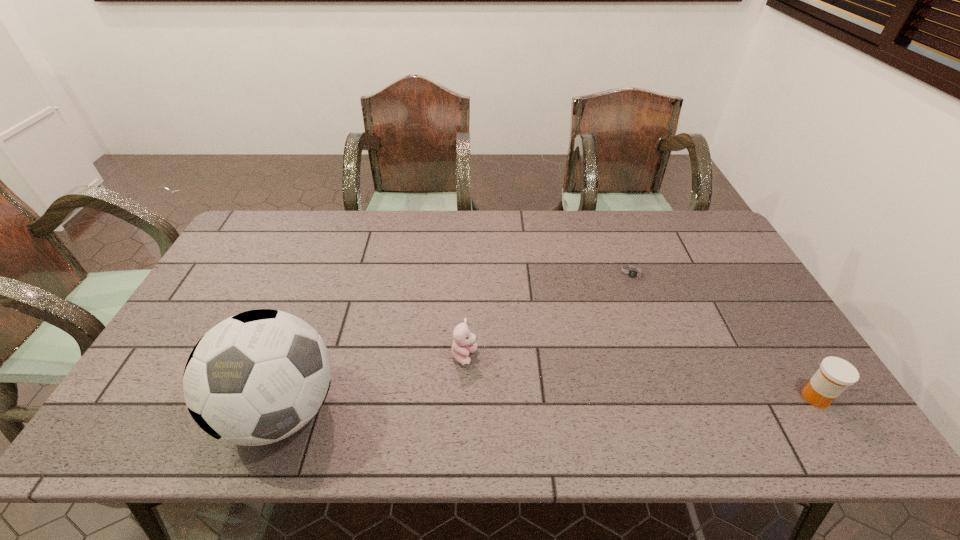
Identify the location of blank space at the far right corner of the desktop. (693, 218).

Image resolution: width=960 pixels, height=540 pixels. Identify the location of free space between the soccer ball and the teddy bear. (373, 383).

I want to click on free point between the watch and the second object from left to right, so click(x=549, y=315).

Locate an element on the screen. This screenshot has width=960, height=540. empty space between the teddy bear and the rightmost object is located at coordinates (x=640, y=377).

You are a GUI agent. You are given a task and a screenshot of the screen. Output one action in this format:
    pyautogui.click(x=<x>, y=<y>)
    Task: Click on the empty space between the teddy bear and the watch
    
    Given the screenshot: What is the action you would take?
    pyautogui.click(x=549, y=315)

Locate an element on the screen. vacant point located between the tallest object and the teddy bear is located at coordinates (373, 383).

You are a GUI agent. You are given a task and a screenshot of the screen. Output one action in this format:
    pyautogui.click(x=<x>, y=<y>)
    Task: Click on the free space between the rightmost object and the tallest object
    The width and height of the screenshot is (960, 540).
    Given the screenshot: What is the action you would take?
    pyautogui.click(x=548, y=404)

Where is `vacant area that lies between the medicine and the tallest object`? Image resolution: width=960 pixels, height=540 pixels. vacant area that lies between the medicine and the tallest object is located at coordinates (548, 404).

At what (x,y) coordinates should I click in order to perform the action: click on vacant area that lies between the teddy bear and the soccer ball. Please return your answer as a coordinate pair (x, y). Looking at the image, I should click on (373, 383).

Where is `object that is the second closest to the soccer ball`? This screenshot has width=960, height=540. object that is the second closest to the soccer ball is located at coordinates (630, 272).